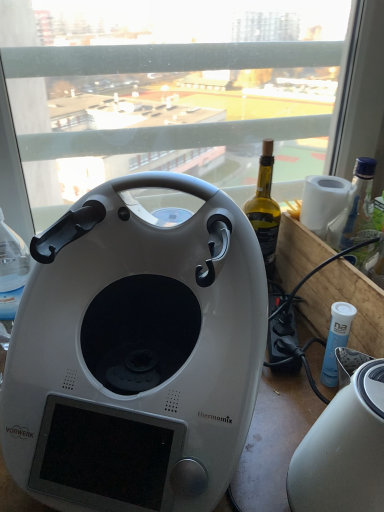
Question: Considering the relative positions of white glossy thermomix at center and transparent glass window at center in the image provided, is white glossy thermomix at center to the left or to the right of transparent glass window at center?

Choices:
 (A) right
 (B) left

Answer: (B)

Question: In terms of height, does white glossy thermomix at center look taller or shorter compared to transparent glass window at center?

Choices:
 (A) tall
 (B) short

Answer: (B)

Question: Which object is the closest to the transparent glass window at center?

Choices:
 (A) white glossy thermomix at center
 (B) white glossy toaster at lower right

Answer: (A)

Question: Which of these objects is positioned farthest from the transparent glass window at center?

Choices:
 (A) white glossy toaster at lower right
 (B) white glossy thermomix at center

Answer: (A)